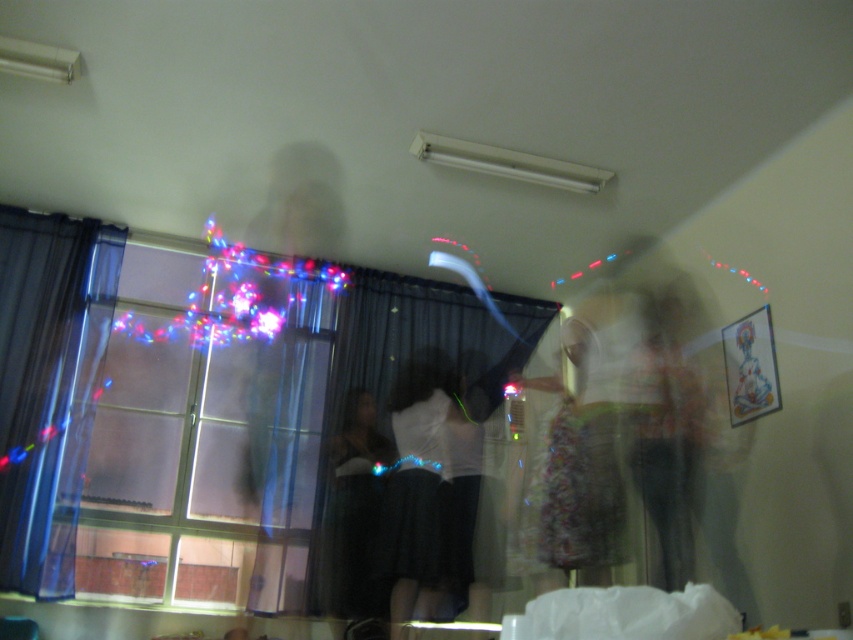
Question: Which point is closer to the camera taking this photo?

Choices:
 (A) (64, 260)
 (B) (351, 433)

Answer: (A)

Question: Estimate the real-world distances between objects in this image. Which object is farther from the translucent glass window at left?

Choices:
 (A) transparent fabric curtain at left
 (B) dark gray dress at center
 (C) matte white blouse at center
 (D) black sheer curtain at center

Answer: (C)

Question: Where is black sheer curtain at center located in relation to matte white blouse at center in the image?

Choices:
 (A) left
 (B) right

Answer: (B)

Question: Can you confirm if translucent glass window at left is positioned above matte white blouse at center?

Choices:
 (A) yes
 (B) no

Answer: (A)

Question: Estimate the real-world distances between objects in this image. Which object is farther from the black sheer curtain at center?

Choices:
 (A) dark gray dress at center
 (B) matte white blouse at center
 (C) translucent glass window at left

Answer: (C)

Question: Is transparent fabric curtain at left above matte white blouse at center?

Choices:
 (A) no
 (B) yes

Answer: (B)